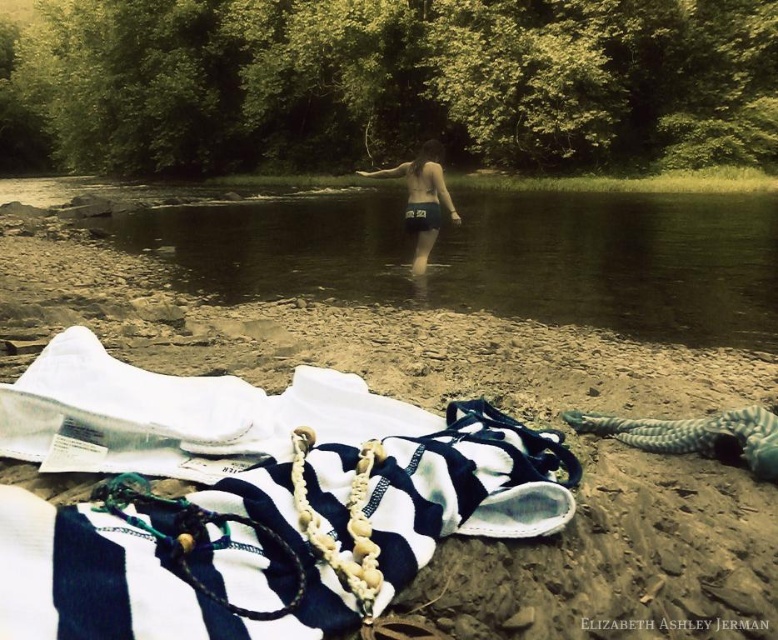
Does white fabric at lower left have a larger size compared to clear water at center?

No, white fabric at lower left is not bigger than clear water at center.

Does white fabric at lower left appear on the right side of clear water at center?

Yes, white fabric at lower left is to the right of clear water at center.

Between point (586, 628) and point (177, 275), which one is positioned behind?

The point (177, 275) is behind.

Locate an element on the screen. white fabric at lower left is located at coordinates (608, 509).

Is point (174, 275) less distant than point (426, 172)?

Yes, it is.

Does clear water at center appear on the left side of dark blue fabric shorts at center?

Correct, you'll find clear water at center to the left of dark blue fabric shorts at center.

Identify the location of clear water at center. Image resolution: width=778 pixels, height=640 pixels. (493, 257).

Does white fabric at lower left appear on the right side of dark blue fabric shorts at center?

Yes, white fabric at lower left is to the right of dark blue fabric shorts at center.

Is white fabric at lower left taller than dark blue fabric shorts at center?

In fact, white fabric at lower left may be shorter than dark blue fabric shorts at center.

Which is behind, point (531, 525) or point (428, 189)?

Point (428, 189)

What are the coordinates of `white fabric at lower left` in the screenshot? It's located at (608, 509).